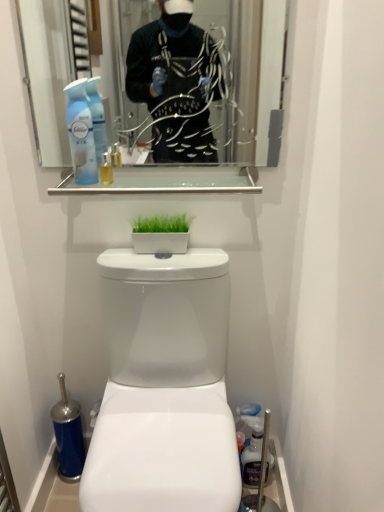
The width and height of the screenshot is (384, 512). I want to click on empty space that is ontop of clear glass shelf at upper center (from a real-world perspective), so click(x=166, y=179).